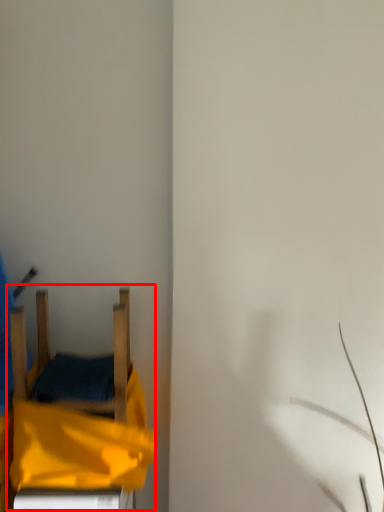
Question: From the image, what is the correct spatial relationship of bed (annotated by the red box) in relation to furniture?

Choices:
 (A) left
 (B) right

Answer: (B)